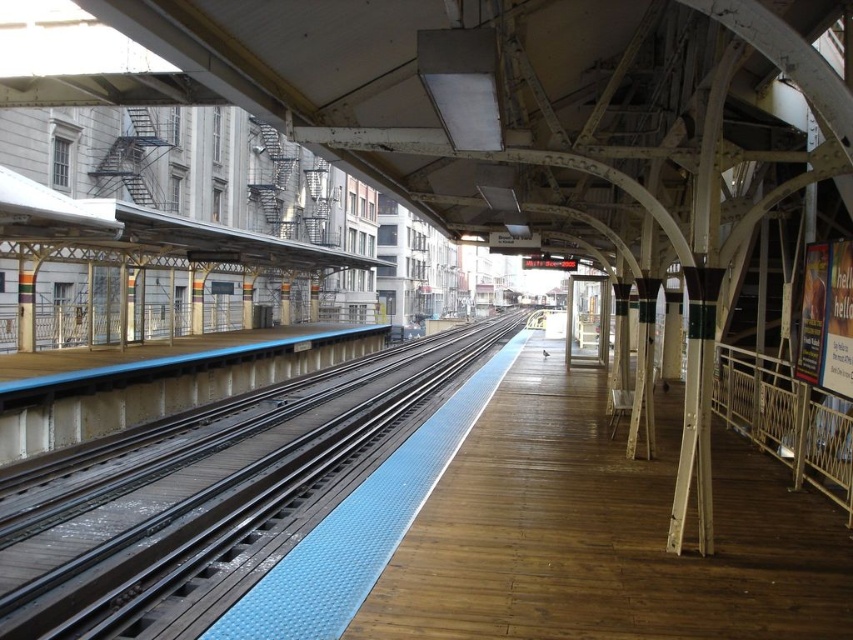
Which is below, wooden platform at center or blue rubber train track at center?

Positioned lower is blue rubber train track at center.

Is point (474, 458) closer to viewer compared to point (102, 616)?

No, (474, 458) is further to viewer.

Identify the location of wooden platform at center. This screenshot has width=853, height=640. (602, 534).